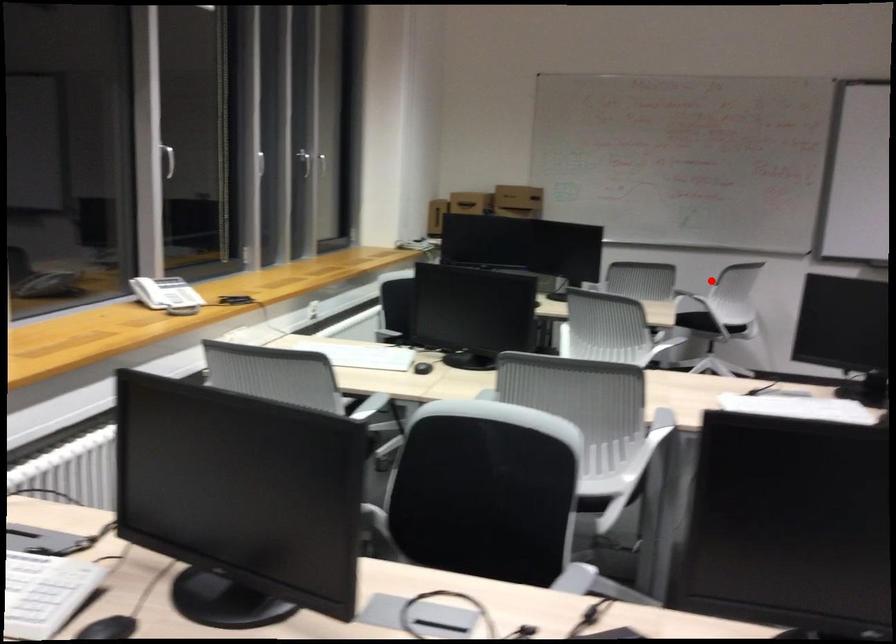
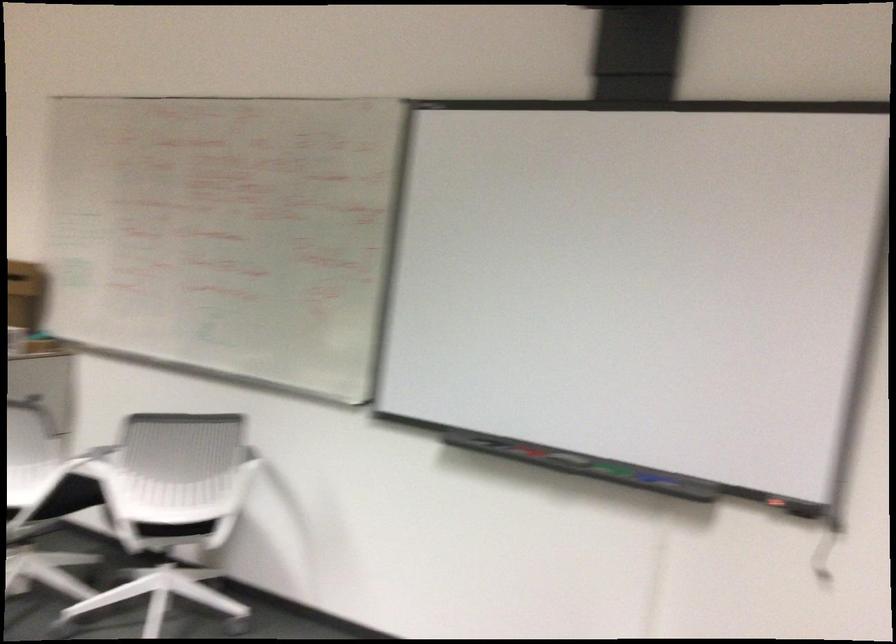
Find the pixel in the second image that matches the highlighted location in the first image.

(95, 460)